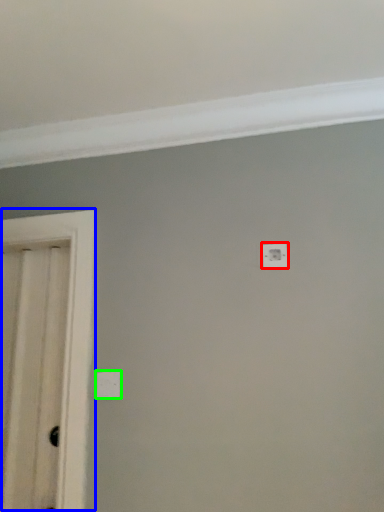
Question: Which object is positioned farthest from light switch (highlighted by a red box)? Select from door (highlighted by a blue box) and light switch (highlighted by a green box).

Choices:
 (A) door
 (B) light switch

Answer: (A)